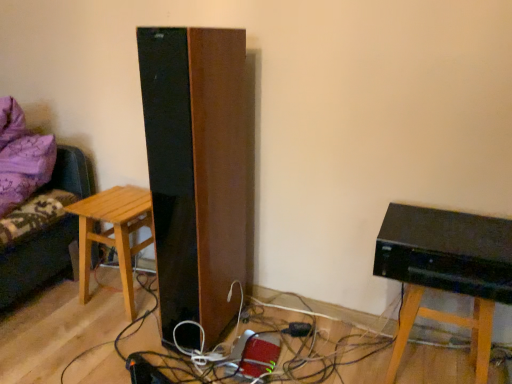
The image size is (512, 384). In order to click on vacant space underneath black glossy computer at lower right (from a real-world perspective) in this screenshot , I will do `click(425, 367)`.